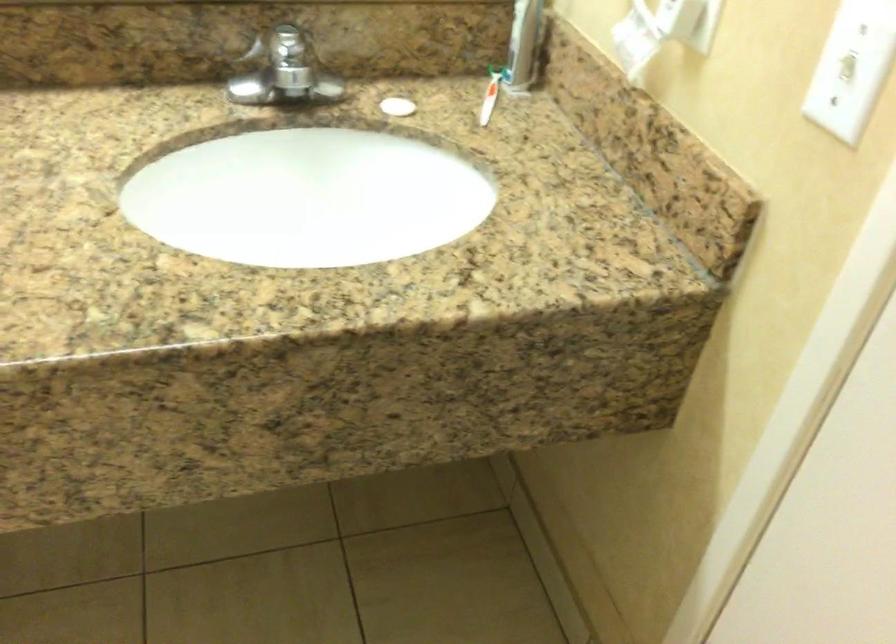
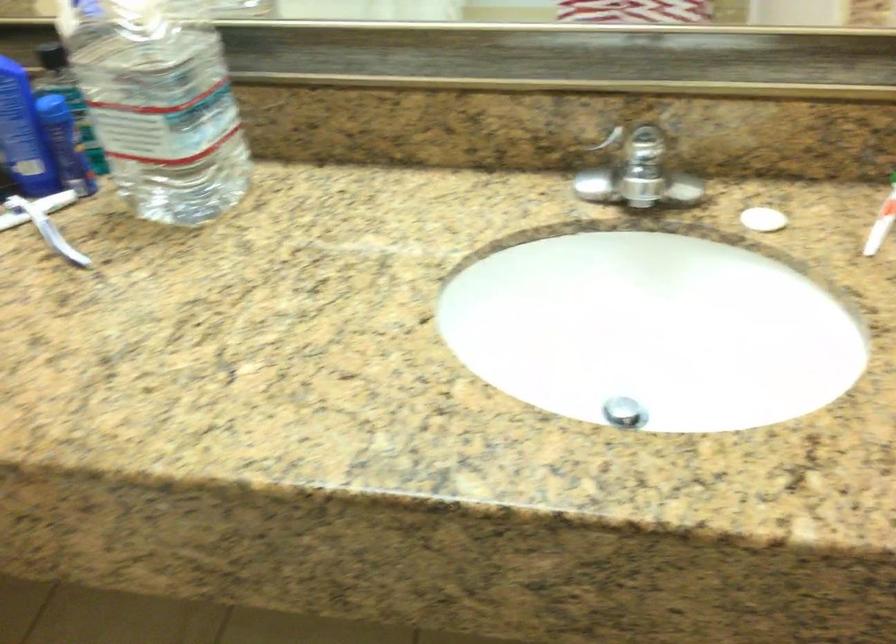
Question: How did the camera likely rotate?

Choices:
 (A) Left
 (B) Right
 (C) Up
 (D) Down

Answer: (A)